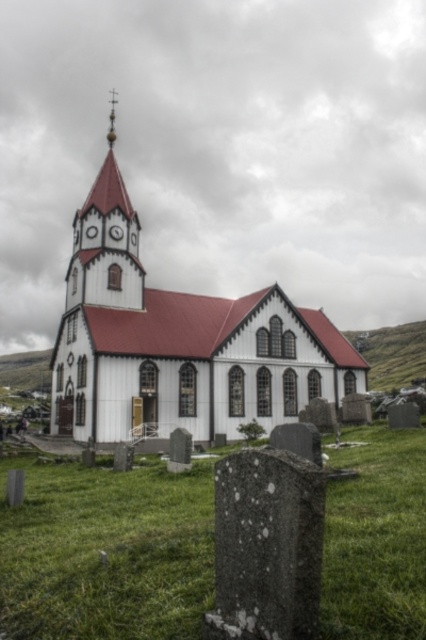
Question: Is the position of white wood church at center more distant than that of granite gravestone at lower center?

Choices:
 (A) no
 (B) yes

Answer: (B)

Question: Is the position of white wood church at center less distant than that of granite gravestone at lower center?

Choices:
 (A) yes
 (B) no

Answer: (B)

Question: Which object is positioned farthest from the granite gravestone at lower center?

Choices:
 (A) white wood church at center
 (B) smooth red spire at upper center
 (C) green stone gravestone at lower center

Answer: (B)

Question: Which point is farther from the camera taking this photo?

Choices:
 (A) (405, 634)
 (B) (304, 582)
 (C) (109, 144)
 (D) (313, 328)

Answer: (D)

Question: Among these objects, which one is nearest to the camera?

Choices:
 (A) green stone gravestone at lower center
 (B) granite gravestone at lower center
 (C) smooth red spire at upper center
 (D) white wood church at center

Answer: (B)

Question: Is white wood church at center wider than granite gravestone at lower center?

Choices:
 (A) yes
 (B) no

Answer: (A)